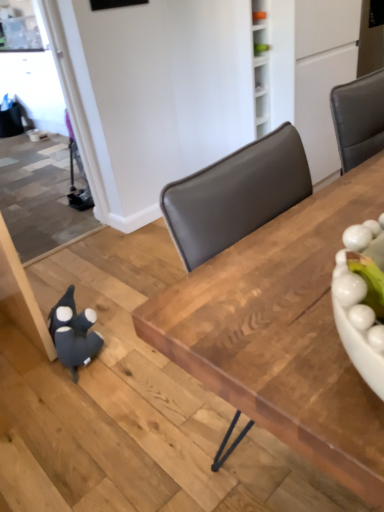
What do you see at coordinates (283, 333) in the screenshot? This screenshot has height=512, width=384. I see `wooden table at center` at bounding box center [283, 333].

Measure the distance between point (227, 397) and camera.

The depth of point (227, 397) is 55.40 centimeters.

Locate an element on the screen. wooden table at center is located at coordinates (283, 333).

This screenshot has height=512, width=384. I want to click on velvety dark blue plush toy at lower left, so click(73, 333).

What do you see at coordinates (73, 333) in the screenshot? Image resolution: width=384 pixels, height=512 pixels. I see `velvety dark blue plush toy at lower left` at bounding box center [73, 333].

This screenshot has height=512, width=384. Find the location of `wooden table at center`. wooden table at center is located at coordinates 283,333.

In the scene shown: Between wooden table at center and velvety dark blue plush toy at lower left, which one appears on the right side from the viewer's perspective?

Positioned to the right is wooden table at center.

Which is behind, wooden table at center or velvety dark blue plush toy at lower left?

velvety dark blue plush toy at lower left.

Which is behind, point (333, 376) or point (91, 310)?

Point (91, 310)

Looking at this image, from the image's perspective, is wooden table at center below velvety dark blue plush toy at lower left?

Incorrect, from the image's perspective, wooden table at center is higher than velvety dark blue plush toy at lower left.

From a real-world perspective, is wooden table at center physically below velvety dark blue plush toy at lower left?

Incorrect, from a real-world perspective, wooden table at center is higher than velvety dark blue plush toy at lower left.

In terms of width, does wooden table at center look wider or thinner when compared to velvety dark blue plush toy at lower left?

wooden table at center is wider than velvety dark blue plush toy at lower left.

Based on the photo, considering the relative sizes of wooden table at center and velvety dark blue plush toy at lower left in the image provided, is wooden table at center taller than velvety dark blue plush toy at lower left?

Yes.

Who is bigger, wooden table at center or velvety dark blue plush toy at lower left?

wooden table at center.

Is wooden table at center outside of velvety dark blue plush toy at lower left?

Yes.

Would you consider wooden table at center to be distant from velvety dark blue plush toy at lower left?

Yes, wooden table at center is far from velvety dark blue plush toy at lower left.

Is wooden table at center looking in the opposite direction of velvety dark blue plush toy at lower left?

Correct, wooden table at center is looking away from velvety dark blue plush toy at lower left.

How far apart are wooden table at center and velvety dark blue plush toy at lower left?

wooden table at center is 3.66 feet away from velvety dark blue plush toy at lower left.

Find the location of a particular element. Image resolution: width=384 pixels, height=512 pixels. toy below the wooden table at center (from the image's perspective) is located at coordinates (73, 333).

Consider the image. Which is more to the right, velvety dark blue plush toy at lower left or wooden table at center?

wooden table at center is more to the right.

Is velvety dark blue plush toy at lower left in front of wooden table at center?

No, velvety dark blue plush toy at lower left is further to the viewer.

Considering the positions of points (73, 301) and (321, 207), is point (73, 301) farther from camera compared to point (321, 207)?

Yes, point (73, 301) is behind point (321, 207).

Consider the image. From the image's perspective, between velvety dark blue plush toy at lower left and wooden table at center, who is located below?

velvety dark blue plush toy at lower left appears lower in the image.

From a real-world perspective, relative to wooden table at center, is velvety dark blue plush toy at lower left vertically above or below?

In terms of real-world spatial position, velvety dark blue plush toy at lower left is below wooden table at center.

In the scene shown: Between velvety dark blue plush toy at lower left and wooden table at center, which one has smaller width?

Thinner between the two is velvety dark blue plush toy at lower left.

Considering the sizes of objects velvety dark blue plush toy at lower left and wooden table at center in the image provided, who is taller, velvety dark blue plush toy at lower left or wooden table at center?

wooden table at center.

Can you confirm if velvety dark blue plush toy at lower left is bigger than wooden table at center?

No.

Which is correct: velvety dark blue plush toy at lower left is inside wooden table at center, or outside of it?

The correct answer is: outside.

Is velvety dark blue plush toy at lower left directly adjacent to wooden table at center?

velvety dark blue plush toy at lower left and wooden table at center are not in contact.

Is wooden table at center at the back of velvety dark blue plush toy at lower left?

No.

Can you tell me how much velvety dark blue plush toy at lower left and wooden table at center differ in facing direction?

The angle between the facing direction of velvety dark blue plush toy at lower left and the facing direction of wooden table at center is 83.7 degrees.

The width and height of the screenshot is (384, 512). I want to click on toy below the wooden table at center (from a real-world perspective), so click(x=73, y=333).

Where is `table on the right of velvety dark blue plush toy at lower left`? table on the right of velvety dark blue plush toy at lower left is located at coordinates click(x=283, y=333).

Locate an element on the screen. table in front of the velvety dark blue plush toy at lower left is located at coordinates (283, 333).